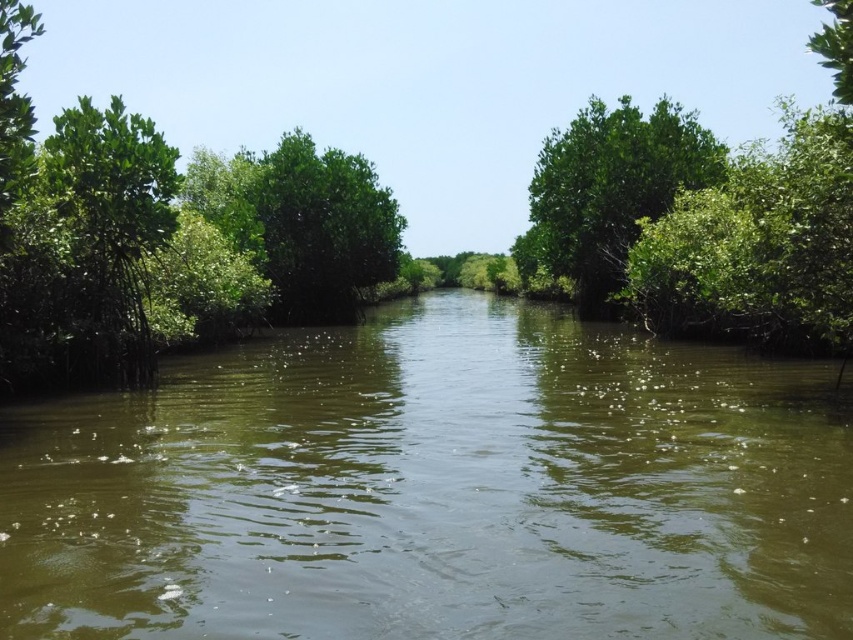
Question: Is green murky water at center to the left of green leafy tree at center from the viewer's perspective?

Choices:
 (A) yes
 (B) no

Answer: (A)

Question: Can you confirm if green murky water at center is positioned above green leafy tree at center?

Choices:
 (A) yes
 (B) no

Answer: (B)

Question: Does green murky water at center have a larger size compared to green leafy tree at center?

Choices:
 (A) no
 (B) yes

Answer: (A)

Question: Which object is closer to the camera taking this photo?

Choices:
 (A) green leafy tree at center
 (B) green murky water at center

Answer: (B)

Question: Which point appears farthest from the camera in this image?

Choices:
 (A) (689, 125)
 (B) (374, 579)

Answer: (A)

Question: Which point is closer to the camera?

Choices:
 (A) green murky water at center
 (B) green leafy tree at center

Answer: (A)